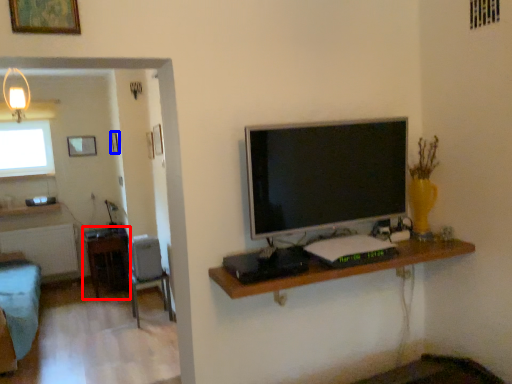
Question: Among these objects, which one is nearest to the camera, table (highlighted by a red box) or picture frame (highlighted by a blue box)?

Choices:
 (A) table
 (B) picture frame

Answer: (A)